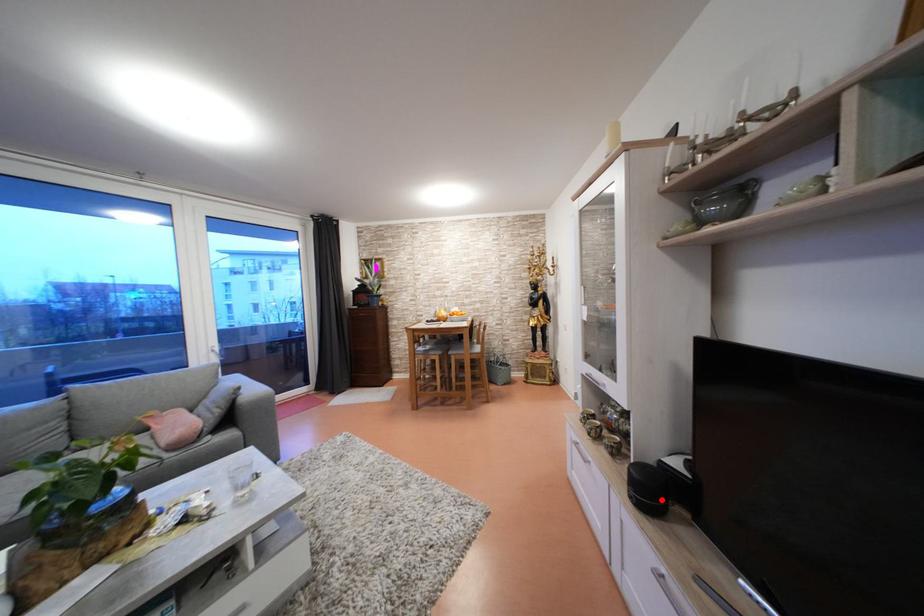
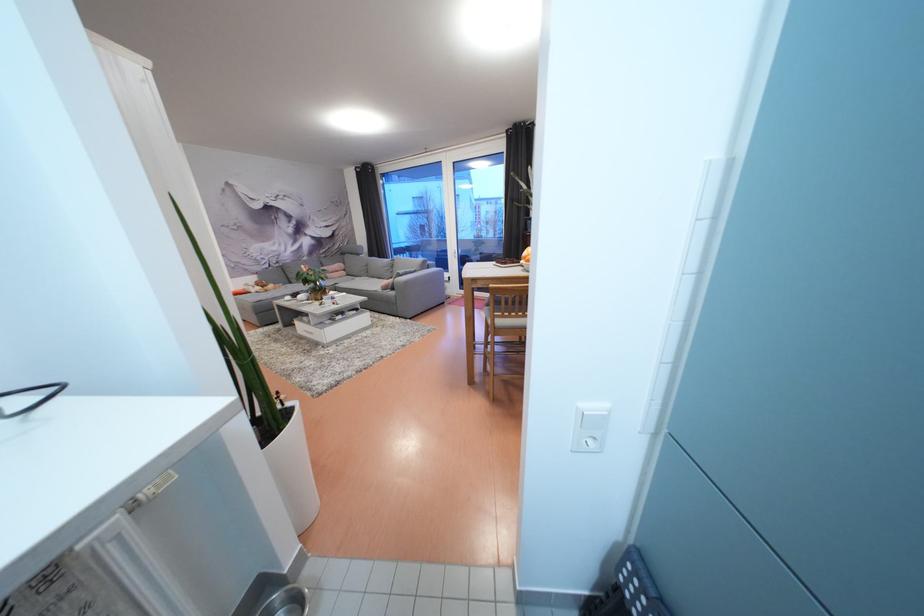
Question: I am providing you with two images of the same scene from different viewpoints. A red point is marked on the first image. At the location where the point appears in image 1, is it still visible in image 2?

Choices:
 (A) Yes
 (B) No

Answer: (B)